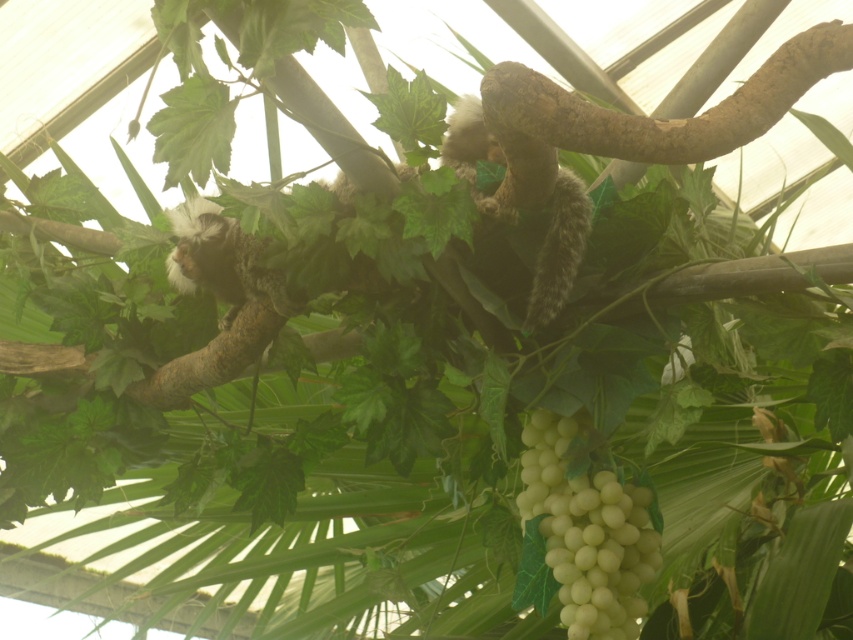
You are a zookeeper in the tropical greenhouse. You need to place a new feeding tray between the brown rough tree branch at upper right and the white matte grapes at lower right. Which side should the feeding tray be placed to ensure it is between them?

The feeding tray should be placed to the left of the brown rough tree branch at upper right and to the right of the white matte grapes at lower right since the branch is to the right of the grapes.

You are a zookeeper in the tropical greenhouse. You need to place a new feeding tray for the marmoset. The tray must be placed below the brown rough tree branch at upper right but above the white matte grapes at lower right. Is this possible?

The brown rough tree branch at upper right is located above the white matte grapes at lower right, so yes, you can place the feeding tray between them as long as it is positioned below the branch and above the grapes.

You are a researcher studying the behavior of primates in their habitat. You observe a primate perched on a branch in a greenhouse. Based on the coordinates provided, can you determine if the brown rough tree branch at upper right is positioned in the upper half of the image?

The brown rough tree branch at upper right is located at coordinates point (670, 120). Since the y coordinate is 0.787, which is above 0.5, it is positioned in the upper half of the image.